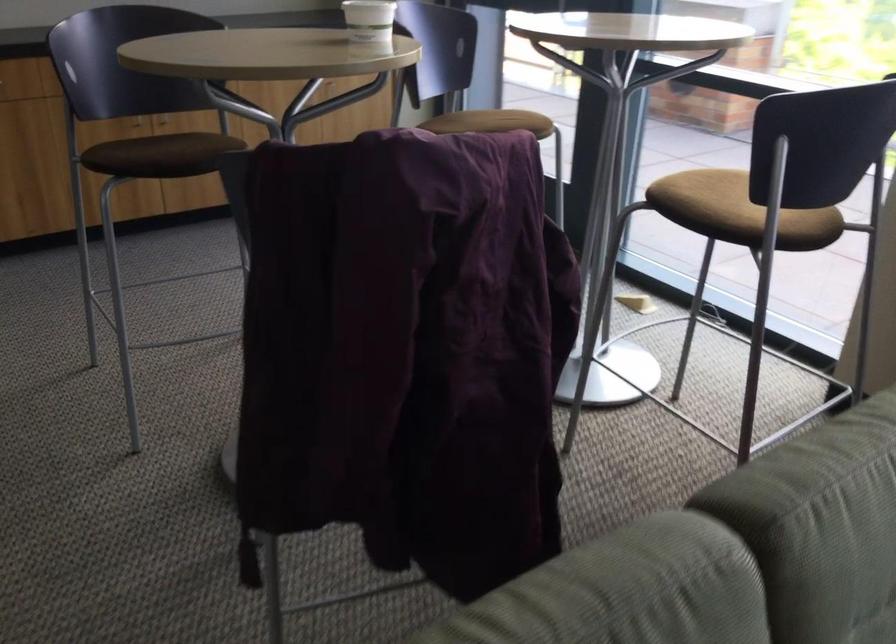
Where would you pull the cabinet handle? Please return your answer as a coordinate pair (x, y).

(160, 122)